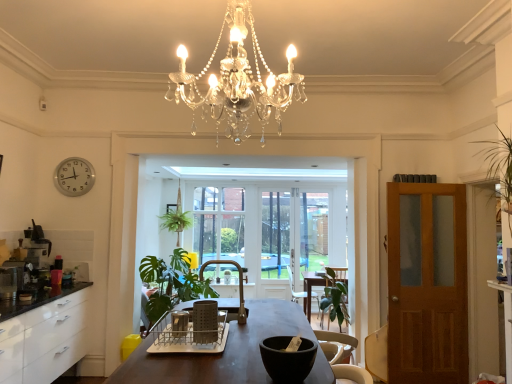
How much space does clear glass window screen at center, the 1th window screen positioned from the left, occupy vertically?

The height of clear glass window screen at center, the 1th window screen positioned from the left, is 5.80 feet.

Identify the location of green fabric armchair at center, which is counted as the first armchair, starting from the top. (239, 286).

Image resolution: width=512 pixels, height=384 pixels. What do you see at coordinates (38, 236) in the screenshot?
I see `metallic black coffee machine at left` at bounding box center [38, 236].

Find the location of `wooden swivel chair at right`. wooden swivel chair at right is located at coordinates tap(377, 353).

You are a GUI agent. You are given a task and a screenshot of the screen. Output one action in this format:
    pyautogui.click(x=<x>, y=<y>)
    Task: Click on the clear glass window screen at center, the 1th window screen positioned from the left
    The height and width of the screenshot is (384, 512).
    Given the screenshot: What is the action you would take?
    pyautogui.click(x=219, y=223)

Which of these two, wooden swivel chair at right or green fabric armchair at center, arranged as the second armchair when viewed from the back, stands taller?

wooden swivel chair at right.

Based on the photo, between wooden swivel chair at right and green fabric armchair at center, arranged as the second armchair when viewed from the back, which one has larger width?

green fabric armchair at center, arranged as the second armchair when viewed from the back, is wider.

Locate an element on the screen. Image resolution: width=512 pixels, height=384 pixels. swivel chair lying below the green fabric armchair at center, arranged as the second armchair when viewed from the back (from the image's perspective) is located at coordinates (377, 353).

The image size is (512, 384). What are the coordinates of `coffee machine on the left of silver metallic clock at upper left` in the screenshot? It's located at (38, 236).

How different are the orientations of metallic black coffee machine at left and silver metallic clock at upper left in degrees?

They differ by 92.7 degrees in their facing directions.

Do you think metallic black coffee machine at left is within silver metallic clock at upper left, or outside of it?

metallic black coffee machine at left is outside silver metallic clock at upper left.

Which is behind, point (33, 232) or point (61, 161)?

The point (61, 161) is more distant.

From the image's perspective, is wooden swivel chair at right beneath dark brown wooden table at center?

Yes, from the image's perspective, wooden swivel chair at right is beneath dark brown wooden table at center.

Is wooden swivel chair at right taller than dark brown wooden table at center?

No.

Which of these two, wooden swivel chair at right or dark brown wooden table at center, is bigger?

Bigger between the two is dark brown wooden table at center.

Are wooden swivel chair at right and dark brown wooden table at center beside each other?

wooden swivel chair at right and dark brown wooden table at center are clearly separated.

In the scene shown: Is black matte bowl at center further to the viewer compared to green fabric armchair at center, the 1th armchair in the back-to-front sequence?

No, it is in front of green fabric armchair at center, the 1th armchair in the back-to-front sequence.

Considering the relative sizes of black matte bowl at center and green fabric armchair at center, positioned as the 1th armchair in bottom-to-top order, in the image provided, is black matte bowl at center wider than green fabric armchair at center, positioned as the 1th armchair in bottom-to-top order,?

Incorrect, the width of black matte bowl at center does not surpass that of green fabric armchair at center, positioned as the 1th armchair in bottom-to-top order.

Which is correct: black matte bowl at center is inside green fabric armchair at center, which is the 1th armchair from right to left, or outside of it?

black matte bowl at center is located beyond the bounds of green fabric armchair at center, which is the 1th armchair from right to left.

Considering the positions of objects black matte bowl at center and green fabric armchair at center, the second armchair in the front-to-back sequence, in the image provided, who is more to the right, black matte bowl at center or green fabric armchair at center, the second armchair in the front-to-back sequence,?

green fabric armchair at center, the second armchair in the front-to-back sequence.

Does green fabric armchair at center, which ranks as the 1th armchair in left-to-right order, have a greater width compared to brown wooden door at right?

Indeed, green fabric armchair at center, which ranks as the 1th armchair in left-to-right order, has a greater width compared to brown wooden door at right.

Consider the image. What's the angular difference between green fabric armchair at center, which is counted as the first armchair, starting from the top, and brown wooden door at right's facing directions?

The angle between the facing direction of green fabric armchair at center, which is counted as the first armchair, starting from the top, and the facing direction of brown wooden door at right is 90 degrees.

From the image's perspective, is green fabric armchair at center, which is counted as the first armchair, starting from the top, located above brown wooden door at right?

Correct, green fabric armchair at center, which is counted as the first armchair, starting from the top, appears higher than brown wooden door at right in the image.

Is green fabric armchair at center, the 2th armchair viewed from the right, positioned far away from brown wooden door at right?

Yes, green fabric armchair at center, the 2th armchair viewed from the right, and brown wooden door at right are quite far apart.

Which object is wider, metallic silver coffee maker at left or wooden swivel chair at right?

Wider between the two is wooden swivel chair at right.

Is metallic silver coffee maker at left located outside wooden swivel chair at right?

Yes, metallic silver coffee maker at left is outside of wooden swivel chair at right.

Considering the relative positions of metallic silver coffee maker at left and wooden swivel chair at right in the image provided, is metallic silver coffee maker at left to the left or to the right of wooden swivel chair at right?

In the image, metallic silver coffee maker at left appears on the left side of wooden swivel chair at right.

Based on the photo, from a real-world perspective, is metallic silver coffee maker at left located beneath wooden swivel chair at right?

No, from a real-world perspective, metallic silver coffee maker at left is not under wooden swivel chair at right.

From a real-world perspective, which object rests below the other?

green fabric armchair at center, which ranks as the 1th armchair in left-to-right order, is physically lower.

Looking at this image, looking at the image, does metallic black coffee machine at left seem bigger or smaller compared to green fabric armchair at center, arranged as the second armchair when viewed from the back?

In the image, metallic black coffee machine at left appears to be larger than green fabric armchair at center, arranged as the second armchair when viewed from the back.

Which of these two, metallic black coffee machine at left or green fabric armchair at center, the 1th armchair viewed from the front, stands shorter?

With less height is green fabric armchair at center, the 1th armchair viewed from the front.

Considering the relative positions of metallic black coffee machine at left and green fabric armchair at center, the 1th armchair viewed from the front, in the image provided, is metallic black coffee machine at left to the left of green fabric armchair at center, the 1th armchair viewed from the front, from the viewer's perspective?

Correct, you'll find metallic black coffee machine at left to the left of green fabric armchair at center, the 1th armchair viewed from the front.

The width and height of the screenshot is (512, 384). In order to click on armchair lying in front of the wooden swivel chair at right in this screenshot , I will do `click(239, 286)`.

At what (x,y) coordinates should I click in order to perform the action: click on clock to the right of metallic black coffee machine at left. Please return your answer as a coordinate pair (x, y). Looking at the image, I should click on (74, 177).

When comparing their distances from green leafy plant at center, does wooden swivel chair at right or metallic black coffee machine at left seem further?

wooden swivel chair at right.

Looking at the image, which one is located further to green leafy plant at center, black matte bowl at center or wooden swivel chair at right?

black matte bowl at center is positioned further to the anchor green leafy plant at center.

When comparing their distances from clear glass window screen at center, which is the 2th window screen from right to left, does green fabric armchair at center, which ranks as the 1th armchair in left-to-right order, or metallic silver coffee maker at left seem closer?

green fabric armchair at center, which ranks as the 1th armchair in left-to-right order, is positioned closer to the anchor clear glass window screen at center, which is the 2th window screen from right to left.

Based on their spatial positions, is green leafy plant at center or green leafy plant at center further from black matte bowl at center?

Based on the image, green leafy plant at center appears to be further to black matte bowl at center.

Looking at the image, which one is located closer to metallic silver coffee maker at left, brown wooden door at right or black matte bowl at center?

The object closer to metallic silver coffee maker at left is black matte bowl at center.

When comparing their distances from dark brown wooden table at center, does clear glass window screen at center, the 1th window screen positioned from the left, or metallic silver coffee maker at left seem further?

A: Among the two, clear glass window screen at center, the 1th window screen positioned from the left, is located further to dark brown wooden table at center.

Based on their spatial positions, is green fabric armchair at center, arranged as the second armchair when viewed from the back, or clear glass window screen at center, the 1th window screen positioned from the left, further from wooden swivel chair at right?

The object further to wooden swivel chair at right is clear glass window screen at center, the 1th window screen positioned from the left.

Considering their positions, is green leafy plant at center positioned closer to silver metallic clock at upper left than clear glass window screen at center, which is the 2th window screen from right to left?

The object closer to silver metallic clock at upper left is green leafy plant at center.

This screenshot has height=384, width=512. Find the location of `swivel chair located between dark brown wooden table at center and clear glass window screen at center, the 2th window screen viewed from the left, in the depth direction`. swivel chair located between dark brown wooden table at center and clear glass window screen at center, the 2th window screen viewed from the left, in the depth direction is located at coordinates (377, 353).

The image size is (512, 384). Identify the location of clock between brown wooden door at right and clear glass window screen at center, the 2th window screen viewed from the left, along the z-axis. (74, 177).

Locate an element on the screen. The width and height of the screenshot is (512, 384). swivel chair located between metallic silver coffee maker at left and brown wooden door at right in the left-right direction is located at coordinates (377, 353).

You are a GUI agent. You are given a task and a screenshot of the screen. Output one action in this format:
    pyautogui.click(x=<x>, y=<y>)
    Task: Click on the clock between metallic silver coffee maker at left and green fabric armchair at center, the second armchair when ordered from bottom to top, in the horizontal direction
    This screenshot has height=384, width=512.
    Given the screenshot: What is the action you would take?
    pyautogui.click(x=74, y=177)